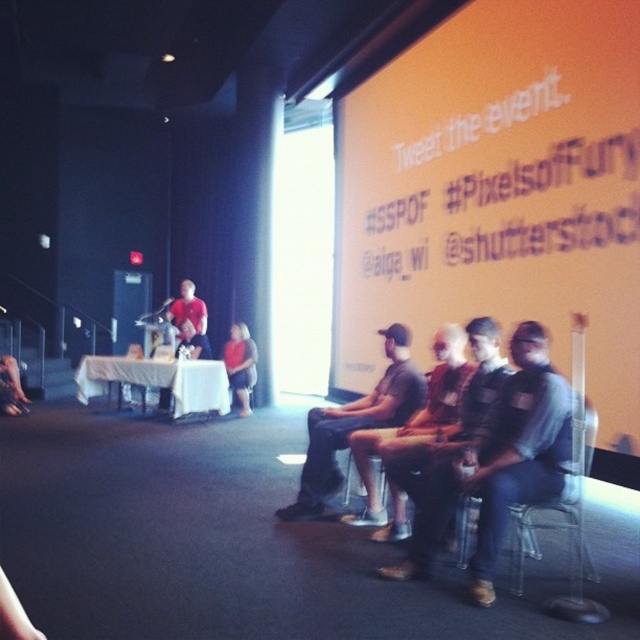
Based on the photo, you are an attendee at the event and want to locate the orange matte projection screen at upper center. Where exactly is it positioned in the room?

The orange matte projection screen at upper center is positioned at point (x=499, y=189) in the room.

You are a photographer positioned at the camera location. You need to capture a photo that includes both the speaker and the orange matte projection screen at upper center. The camera has a maximum focus range of 4 meters. Will you be able to focus on both subjects simultaneously?

The orange matte projection screen at upper center is 4.21 meters from the camera. Since the maximum focus range is 4 meters, the screen is slightly out of range. Therefore, you cannot focus on both the speaker and the screen at the same time.